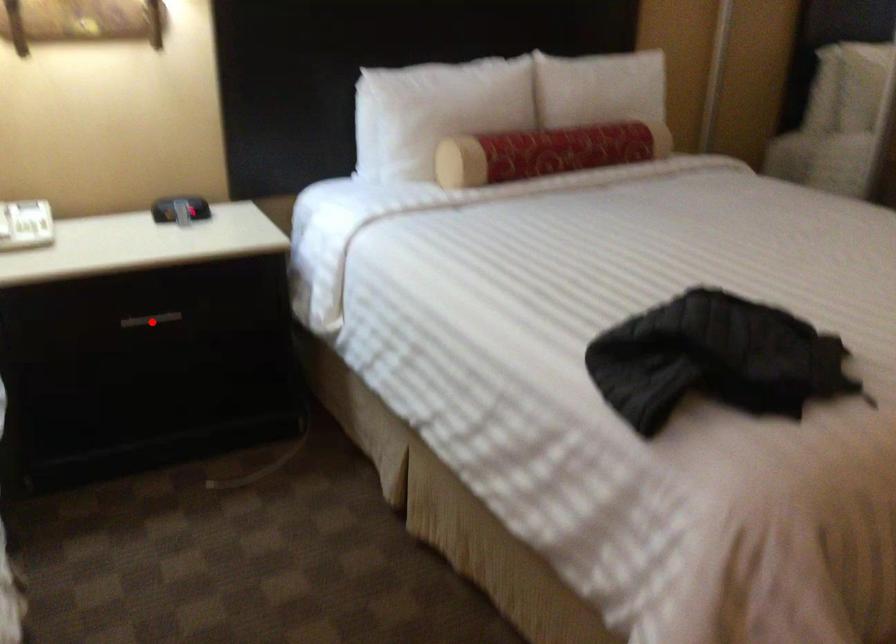
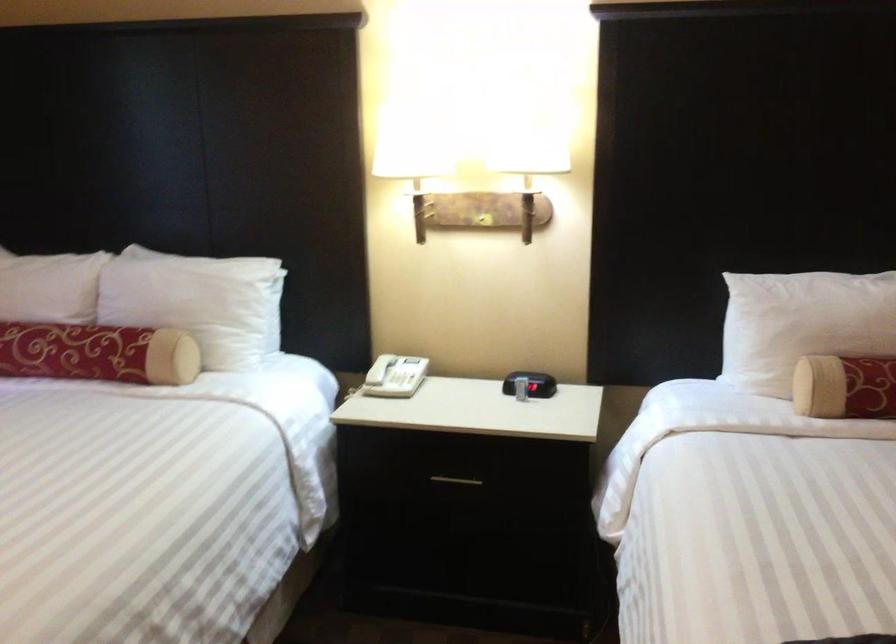
Where in the second image is the point corresponding to the highlighted location from the first image?

(455, 480)